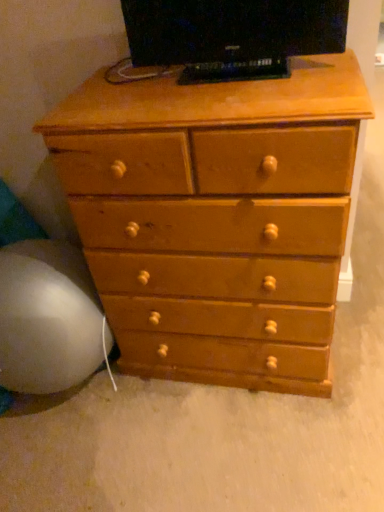
Find the location of a particular element. free space in front of light brown wood chest of drawers at center is located at coordinates (232, 447).